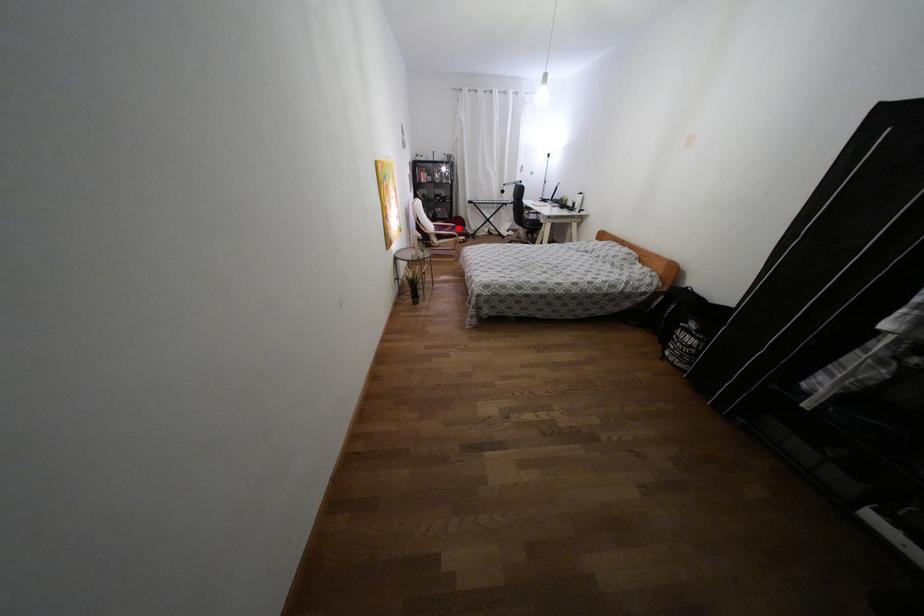
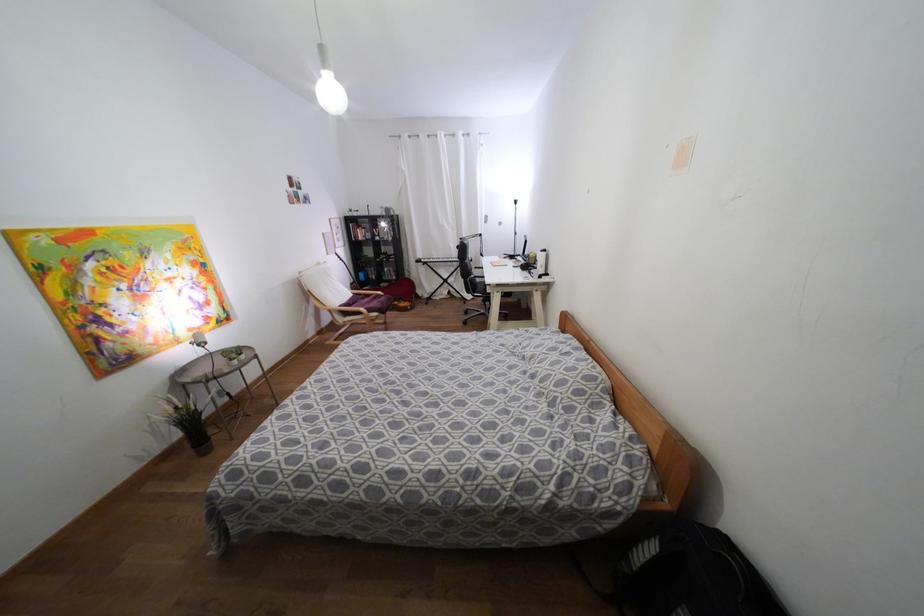
Question: A red point is marked in image1. In image2, is the corresponding 3D point closer to the camera or farther? Reply with the corresponding letter.

Choices:
 (A) The corresponding 3D point is closer.
 (B) The corresponding 3D point is farther.

Answer: (A)